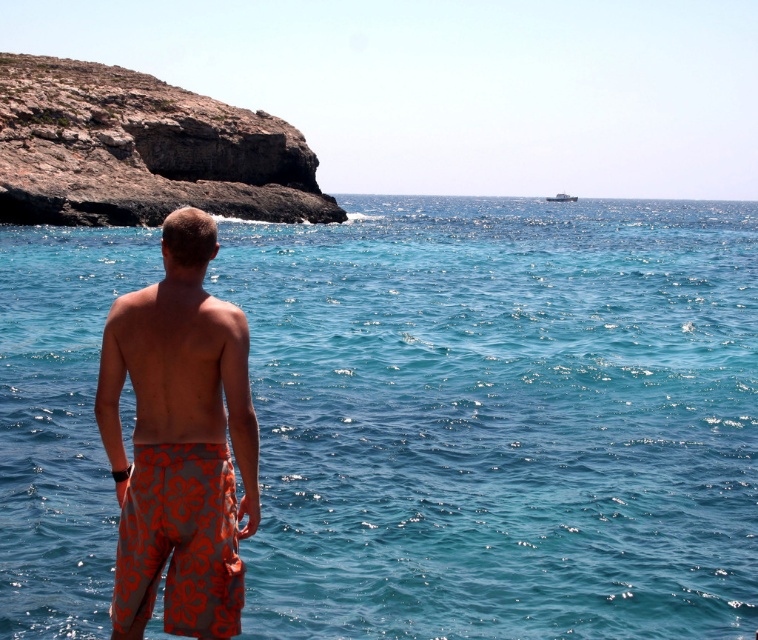
Question: Considering the relative positions of translucent blue water at center and rugged brown rock at upper left in the image provided, where is translucent blue water at center located with respect to rugged brown rock at upper left?

Choices:
 (A) below
 (B) above

Answer: (A)

Question: Which point is farther to the camera?

Choices:
 (A) (146, 454)
 (B) (271, 324)

Answer: (B)

Question: From the image, what is the correct spatial relationship of translucent blue water at center in relation to orange printed shorts at center?

Choices:
 (A) above
 (B) below

Answer: (A)

Question: Which of the following is the closest to the observer?

Choices:
 (A) orange printed shorts at center
 (B) translucent blue water at center
 (C) orange printed shorts at lower center
 (D) rugged brown rock at upper left

Answer: (C)

Question: Among these points, which one is farthest from the camera?

Choices:
 (A) tap(381, 532)
 (B) tap(180, 376)

Answer: (A)

Question: Does translucent blue water at center appear on the left side of rugged brown rock at upper left?

Choices:
 (A) yes
 (B) no

Answer: (B)